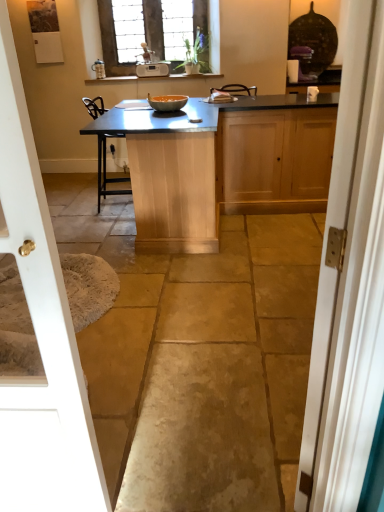
Question: Visually, is matte wood cabinet at right, which is the first cabinetry in right-to-left order, positioned to the left or to the right of white painted wood door at right, arranged as the 1th door when viewed from the right?

Choices:
 (A) left
 (B) right

Answer: (B)

Question: From a real-world perspective, relative to white painted wood door at right, which is the 2th door from left to right, is matte wood cabinet at right, which is counted as the 2th cabinetry, starting from the left, vertically above or below?

Choices:
 (A) below
 (B) above

Answer: (A)

Question: Which of these objects is positioned closest to the matte wood cabinet at right, which is counted as the 2th cabinetry, starting from the left?

Choices:
 (A) natural stone floor at center
 (B) stained glass window at upper center
 (C) white plastic radio at upper center
 (D) white glossy door at left, the first door in the left-to-right sequence
 (E) translucent glass bowl at center

Answer: (A)

Question: Which of these objects is positioned closest to the translucent glass bowl at center?

Choices:
 (A) white glossy door at left, the first door in the left-to-right sequence
 (B) matte silver faucet at upper center
 (C) natural stone floor at center
 (D) matte wood cabinet at right, which is the first cabinetry in right-to-left order
 (E) white painted wood door at right, which is the 2th door from left to right

Answer: (D)